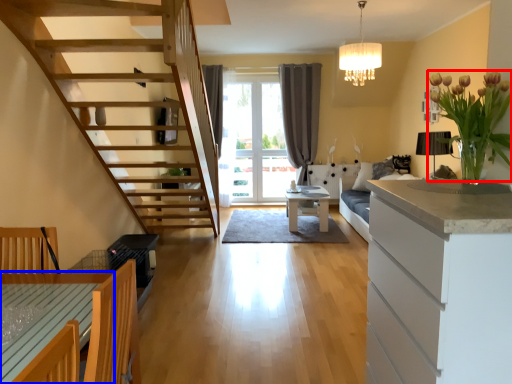
Question: Among these objects, which one is farthest to the camera, flower (highlighted by a red box) or table (highlighted by a blue box)?

Choices:
 (A) flower
 (B) table

Answer: (A)